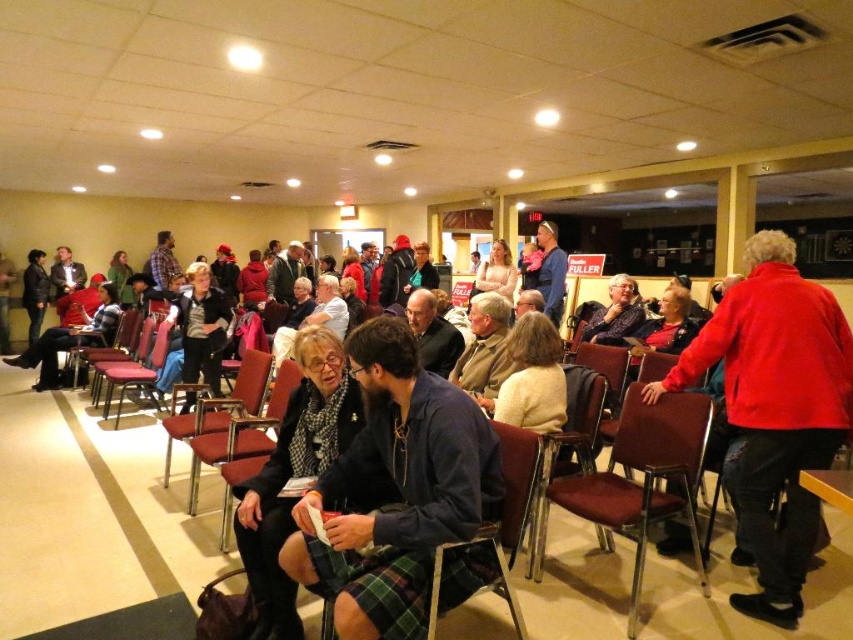
Question: Which object is positioned closest to the dark blue fabric shirt at center?

Choices:
 (A) red fabric chair at left
 (B) brown fabric chair at right

Answer: (B)

Question: Can you confirm if brown fabric chair at right is thinner than metallic red chair at left?

Choices:
 (A) no
 (B) yes

Answer: (B)

Question: Among these objects, which one is nearest to the camera?

Choices:
 (A) red fabric chair at left
 (B) plaid skirt at center

Answer: (B)

Question: Does metallic silver chair at center have a larger size compared to metallic red chair at left?

Choices:
 (A) yes
 (B) no

Answer: (B)

Question: Does brown fabric chair at right appear under red fabric chair at left?

Choices:
 (A) yes
 (B) no

Answer: (A)

Question: Estimate the real-world distances between objects in this image. Which object is closer to the dark blue fabric shirt at center?

Choices:
 (A) metallic silver chair at center
 (B) metallic red chair at left
 (C) plaid skirt at center

Answer: (C)